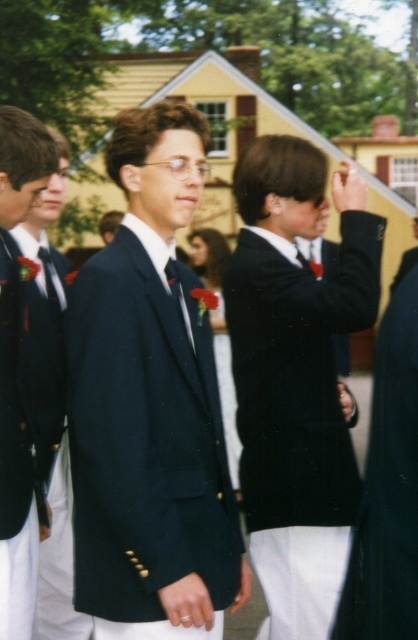
Is point (180, 593) positioned in front of point (15, 134)?

Yes.

Can you confirm if navy blue suit at center is smaller than matte black blazer at left?

Actually, navy blue suit at center might be larger than matte black blazer at left.

Where is `navy blue suit at center`? navy blue suit at center is located at coordinates (150, 406).

Identify the location of navy blue suit at center. (150, 406).

Consider the image. Is matte black blazer at center shorter than matte black blazer at left?

In fact, matte black blazer at center may be taller than matte black blazer at left.

Locate an element on the screen. The image size is (418, 640). matte black blazer at center is located at coordinates (297, 374).

The image size is (418, 640). I want to click on matte black blazer at center, so click(297, 374).

What do you see at coordinates (150, 406) in the screenshot? This screenshot has width=418, height=640. I see `navy blue suit at center` at bounding box center [150, 406].

Can you confirm if navy blue suit at center is positioned to the left of matte black blazer at center?

Correct, you'll find navy blue suit at center to the left of matte black blazer at center.

This screenshot has width=418, height=640. I want to click on navy blue suit at center, so click(x=150, y=406).